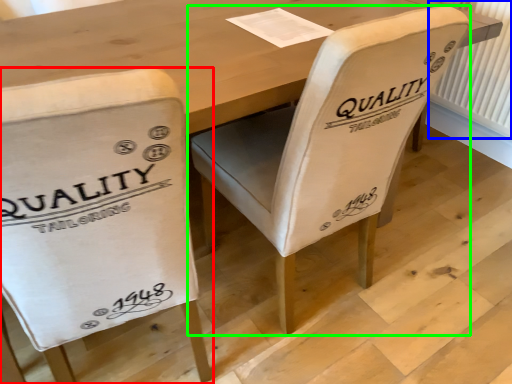
Question: Based on their relative distances, which object is farther from chair (highlighted by a red box)? Choose from radiator (highlighted by a blue box) and chair (highlighted by a green box).

Choices:
 (A) radiator
 (B) chair

Answer: (A)